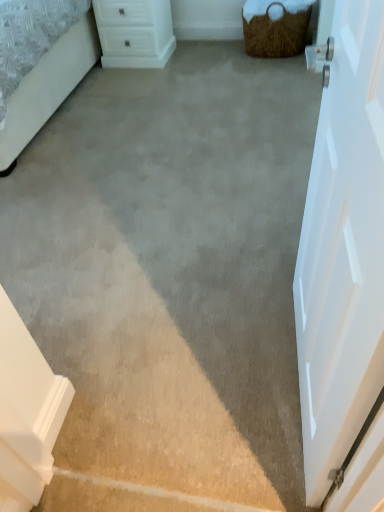
Identify the location of free space to the left of white smooth door at right. (188, 352).